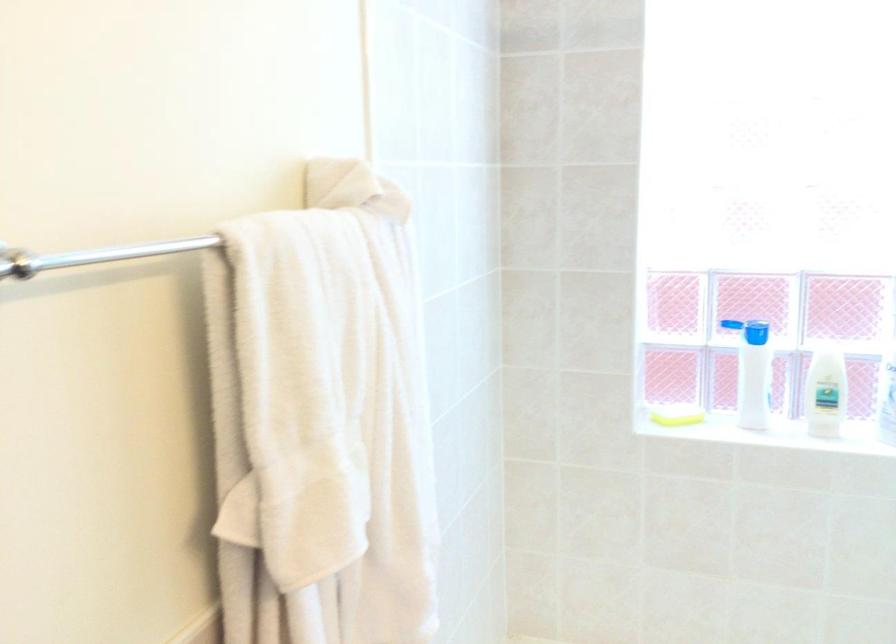
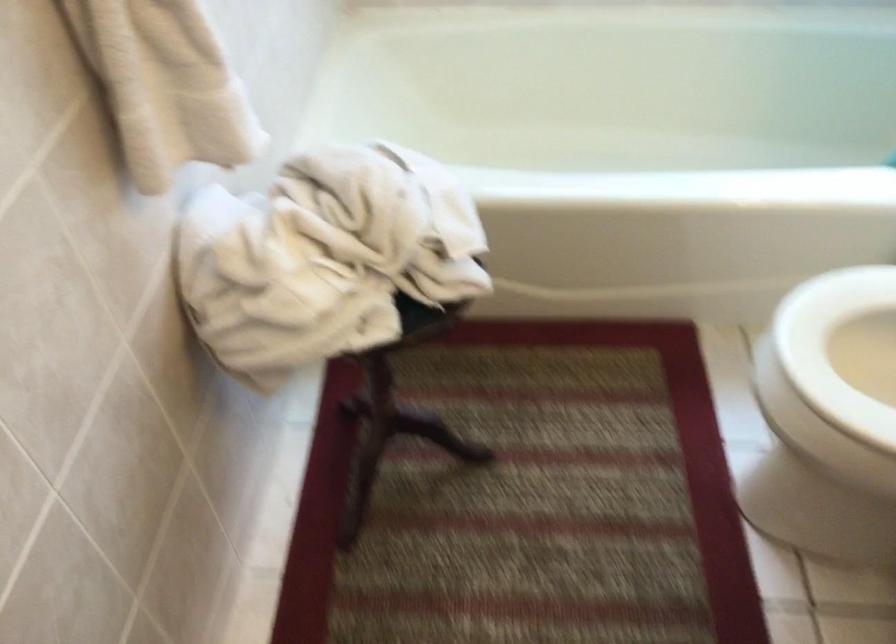
Question: How did the camera likely rotate?

Choices:
 (A) Left
 (B) Right
 (C) Up
 (D) Down

Answer: (D)